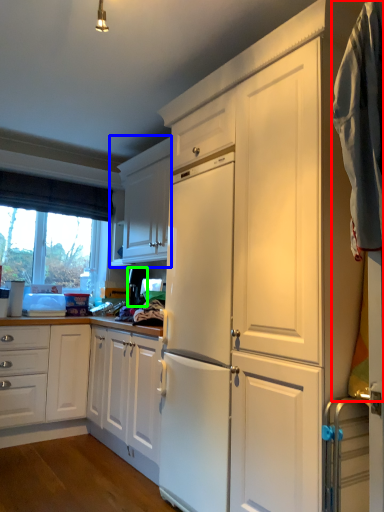
Question: Which is nearer to the laundry (highlighted by a red box)? cabinetry (highlighted by a blue box) or appliance (highlighted by a green box).

Choices:
 (A) cabinetry
 (B) appliance

Answer: (B)